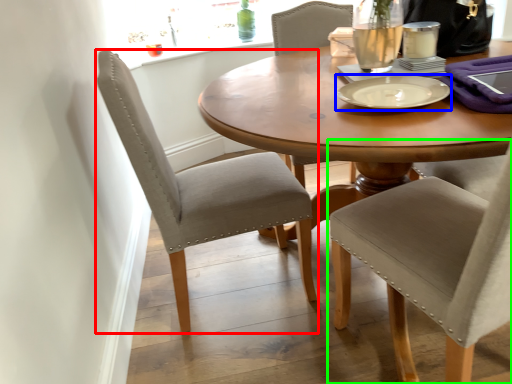
Question: Which object is the farthest from chair (highlighted by a red box)? Choose among these: tableware (highlighted by a blue box) or chair (highlighted by a green box).

Choices:
 (A) tableware
 (B) chair

Answer: (A)